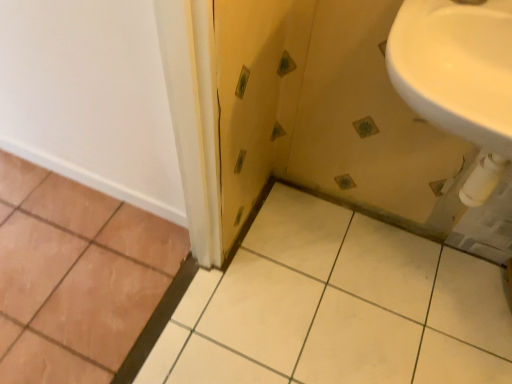
Find the location of `white glossy sink at upper right`. white glossy sink at upper right is located at coordinates (456, 67).

Describe the element at coordinates (456, 67) in the screenshot. The width and height of the screenshot is (512, 384). I see `white glossy sink at upper right` at that location.

At what (x,y) coordinates should I click in order to perform the action: click on white glossy sink at upper right. Please return your answer as a coordinate pair (x, y). This screenshot has height=384, width=512. Looking at the image, I should click on (456, 67).